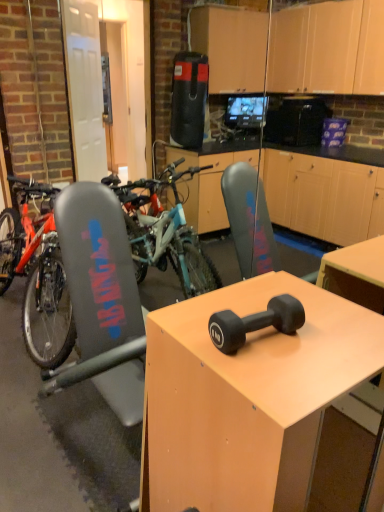
Question: Considering the positions of matte black dumbbell at center and black rubber dumbbell at center in the image, is matte black dumbbell at center wider or thinner than black rubber dumbbell at center?

Choices:
 (A) thin
 (B) wide

Answer: (B)

Question: From a real-world perspective, relative to black rubber dumbbell at center, is matte black dumbbell at center vertically above or below?

Choices:
 (A) below
 (B) above

Answer: (A)

Question: Which object is the farthest from the black rubber dumbbell at center?

Choices:
 (A) teal matte mountain bike at left
 (B) matte black dumbbell at center

Answer: (A)

Question: Which object is positioned closest to the teal matte mountain bike at left?

Choices:
 (A) matte black dumbbell at center
 (B) black rubber dumbbell at center

Answer: (A)